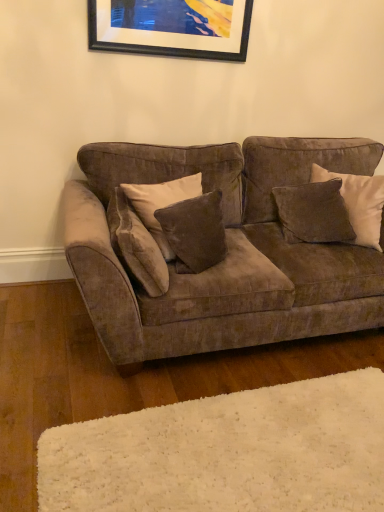
Question: Considering the positions of velvet brown pillow at right, which is the 3th pillow in left-to-right order, and velvet brown couch at center in the image, is velvet brown pillow at right, which is the 3th pillow in left-to-right order, bigger or smaller than velvet brown couch at center?

Choices:
 (A) small
 (B) big

Answer: (A)

Question: Is velvet brown pillow at right, the second pillow viewed from the right, wider or thinner than velvet brown couch at center?

Choices:
 (A) wide
 (B) thin

Answer: (B)

Question: Which object is the farthest from the white shag rug at lower center?

Choices:
 (A) velvet brown pillow at center, the second pillow viewed from the left
 (B) velvet brown pillow at center, the 4th pillow in the right-to-left sequence
 (C) velvet brown couch at center
 (D) velvet brown pillow at upper right, which appears as the 1th pillow when viewed from the right
 (E) black matte picture frame at upper center

Answer: (E)

Question: Which object is the farthest from the velvet brown pillow at upper right, which appears as the 1th pillow when viewed from the right?

Choices:
 (A) velvet brown pillow at right, the second pillow viewed from the right
 (B) velvet brown couch at center
 (C) white shag rug at lower center
 (D) velvet brown pillow at center, the second pillow viewed from the left
 (E) velvet brown pillow at center, the 4th pillow in the right-to-left sequence

Answer: (C)